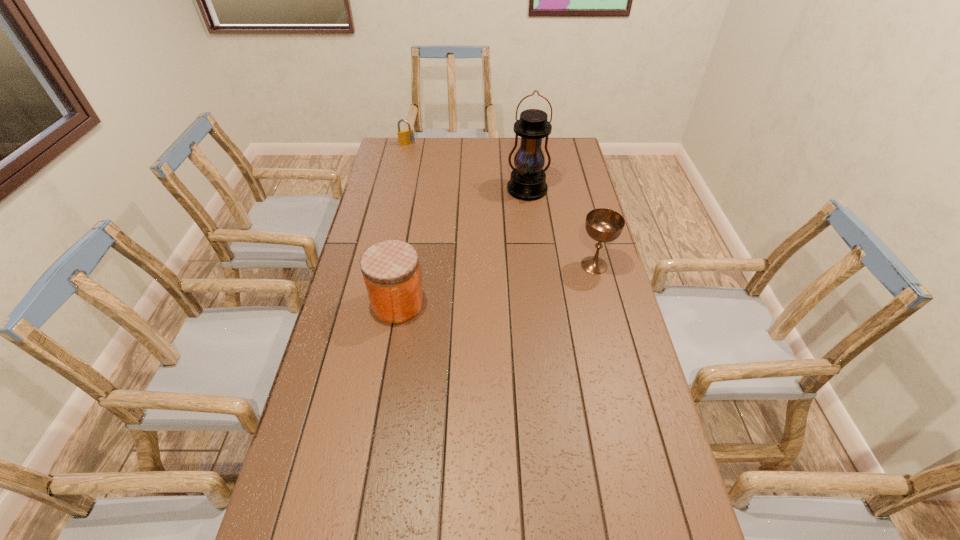
Find the location of a particular element. The width and height of the screenshot is (960, 540). free space between the lantern and the shortest object is located at coordinates (467, 167).

Find the location of a particular element. free space that is in between the second nearest object and the farthest object is located at coordinates (500, 205).

Find the location of a particular element. unoccupied area between the nearest object and the second nearest object is located at coordinates (496, 285).

You are a GUI agent. You are given a task and a screenshot of the screen. Output one action in this format:
    pyautogui.click(x=<x>, y=<y>)
    Task: Click on the free space between the farthest object and the third farthest object
    
    Given the screenshot: What is the action you would take?
    pyautogui.click(x=500, y=205)

Point out which object is positioned as the third nearest to the chalice. Please provide its 2D coordinates. Your answer should be formatted as a tuple, i.e. [(x, y)], where the tuple contains the x and y coordinates of a point satisfying the conditions above.

[(405, 137)]

Image resolution: width=960 pixels, height=540 pixels. I want to click on the third closest object relative to the rightmost object, so click(405, 137).

You are a GUI agent. You are given a task and a screenshot of the screen. Output one action in this format:
    pyautogui.click(x=<x>, y=<y>)
    Task: Click on the free space that satisfies the following two spatial constraints: 1. on the front side of the shortest object; 2. on the right side of the tallest object
    
    Given the screenshot: What is the action you would take?
    click(x=396, y=191)

At what (x,y) coordinates should I click in order to perform the action: click on vacant space that satisfies the following two spatial constraints: 1. on the front side of the shortest object; 2. on the left side of the chalice. Please return your answer as a coordinate pair (x, y). Looking at the image, I should click on (379, 265).

The width and height of the screenshot is (960, 540). What are the coordinates of `free spot that satisfies the following two spatial constraints: 1. on the front side of the tallest object; 2. on the left side of the chalice` in the screenshot? It's located at (537, 265).